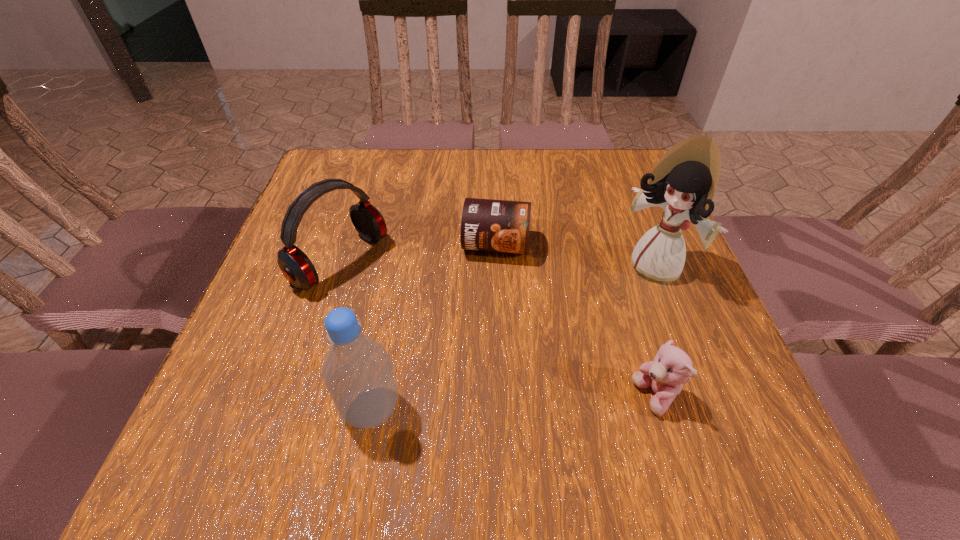
Where is `free space in the image that satisfies the following two spatial constraints: 1. on the back side of the second tallest object; 2. on the right side of the can`? This screenshot has width=960, height=540. free space in the image that satisfies the following two spatial constraints: 1. on the back side of the second tallest object; 2. on the right side of the can is located at coordinates (401, 245).

In order to click on vacant space that satisfies the following two spatial constraints: 1. on the front side of the tallest object; 2. on the right side of the third tallest object in this screenshot , I will do click(x=338, y=268).

The width and height of the screenshot is (960, 540). Find the location of `free space that satisfies the following two spatial constraints: 1. on the front side of the earphone; 2. at the face of the teddy bear`. free space that satisfies the following two spatial constraints: 1. on the front side of the earphone; 2. at the face of the teddy bear is located at coordinates (298, 397).

You are a GUI agent. You are given a task and a screenshot of the screen. Output one action in this format:
    pyautogui.click(x=<x>, y=<y>)
    Task: Click on the vacant space that satisfies the following two spatial constraints: 1. on the front side of the third object from left to right; 2. at the face of the teddy bear
    This screenshot has width=960, height=540.
    Given the screenshot: What is the action you would take?
    pyautogui.click(x=501, y=397)

Where is `vacant space that satisfies the following two spatial constraints: 1. on the back side of the third object from right to left; 2. on the left side of the third tallest object`? This screenshot has height=540, width=960. vacant space that satisfies the following two spatial constraints: 1. on the back side of the third object from right to left; 2. on the left side of the third tallest object is located at coordinates (346, 245).

This screenshot has height=540, width=960. I want to click on free location that satisfies the following two spatial constraints: 1. on the front side of the tallest object; 2. on the left side of the third tallest object, so click(338, 268).